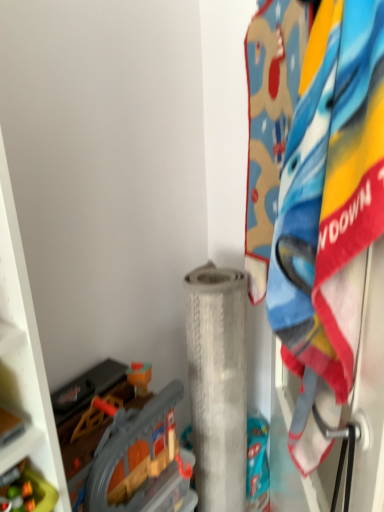
Describe the element at coordinates (328, 214) in the screenshot. I see `fluffy cotton towel at right` at that location.

Where is `white textured roll at center`? This screenshot has width=384, height=512. white textured roll at center is located at coordinates (217, 384).

Which object is thinner, fluffy cotton towel at right or white textured roll at center?

With smaller width is fluffy cotton towel at right.

Could you tell me if fluffy cotton towel at right is facing white textured roll at center?

No, fluffy cotton towel at right does not turn towards white textured roll at center.

From the image's perspective, is fluffy cotton towel at right on white textured roll at center?

Correct, fluffy cotton towel at right appears higher than white textured roll at center in the image.

Is fluffy cotton towel at right at the right side of white textured roll at center?

Correct, you'll find fluffy cotton towel at right to the right of white textured roll at center.

From a real-world perspective, is plastic gray train set at lower left, which appears as the 1th toy when viewed from the back, physically located above or below white textured roll at center?

From a real-world perspective, plastic gray train set at lower left, which appears as the 1th toy when viewed from the back, is physically above white textured roll at center.

From the image's perspective, which one is positioned higher, plastic gray train set at lower left, which appears as the second toy when viewed from the front, or white textured roll at center?

plastic gray train set at lower left, which appears as the second toy when viewed from the front.

In terms of size, does plastic gray train set at lower left, which appears as the second toy when viewed from the front, appear bigger or smaller than white textured roll at center?

plastic gray train set at lower left, which appears as the second toy when viewed from the front, is smaller than white textured roll at center.

Can you confirm if plastic gray train set at lower left, which appears as the 1th toy when viewed from the back, is taller than white textured roll at center?

Incorrect, the height of plastic gray train set at lower left, which appears as the 1th toy when viewed from the back, is not larger of that of white textured roll at center.

From the image's perspective, is fluffy cotton towel at right above or below plastic gray train set at lower left, which appears as the 1th toy when viewed from the back?

From the image's perspective, fluffy cotton towel at right appears above plastic gray train set at lower left, which appears as the 1th toy when viewed from the back.

Which is behind, fluffy cotton towel at right or plastic gray train set at lower left, which appears as the 1th toy when viewed from the back?

plastic gray train set at lower left, which appears as the 1th toy when viewed from the back, is further away from the camera.

Can you confirm if fluffy cotton towel at right is thinner than plastic gray train set at lower left, which appears as the 1th toy when viewed from the back?

Yes, fluffy cotton towel at right is thinner than plastic gray train set at lower left, which appears as the 1th toy when viewed from the back.

Would you say plastic gray train set at lower left, which appears as the 1th toy when viewed from the back, is part of fluffy cotton towel at right's contents?

Definitely not — plastic gray train set at lower left, which appears as the 1th toy when viewed from the back, is not inside fluffy cotton towel at right.

Is white textured roll at center facing away from plastic gray train set at lower left, which appears as the 1th toy when viewed from the back?

A: That's not correct — white textured roll at center is not looking away from plastic gray train set at lower left, which appears as the 1th toy when viewed from the back.

Relative to plastic gray train set at lower left, which appears as the second toy when viewed from the front, is white textured roll at center in front or behind?

Visually, white textured roll at center is located behind plastic gray train set at lower left, which appears as the second toy when viewed from the front.

Which is correct: white textured roll at center is inside plastic gray train set at lower left, which appears as the second toy when viewed from the front, or outside of it?

white textured roll at center lies outside plastic gray train set at lower left, which appears as the second toy when viewed from the front.

Is white textured roll at center at the right side of plastic gray train set at lower left, which appears as the 1th toy when viewed from the back?

Yes, white textured roll at center is to the right of plastic gray train set at lower left, which appears as the 1th toy when viewed from the back.

Find the location of `toilet paper below the translucent plastic toy at lower left, which ranks as the second toy in back-to-front order (from a real-world perspective)`. toilet paper below the translucent plastic toy at lower left, which ranks as the second toy in back-to-front order (from a real-world perspective) is located at coordinates (217, 384).

Is translucent plastic toy at lower left, positioned as the first toy in front-to-back order, at the back of white textured roll at center?

white textured roll at center does not have its back to translucent plastic toy at lower left, positioned as the first toy in front-to-back order.

Based on the photo, from the image's perspective, which object appears higher, white textured roll at center or translucent plastic toy at lower left, positioned as the first toy in front-to-back order?

translucent plastic toy at lower left, positioned as the first toy in front-to-back order, is shown above in the image.

Is translucent plastic toy at lower left, positioned as the first toy in front-to-back order, touching plastic gray train set at lower left, which appears as the second toy when viewed from the front?

No.

Is translucent plastic toy at lower left, positioned as the first toy in front-to-back order, thinner than plastic gray train set at lower left, which appears as the 1th toy when viewed from the back?

Correct, the width of translucent plastic toy at lower left, positioned as the first toy in front-to-back order, is less than that of plastic gray train set at lower left, which appears as the 1th toy when viewed from the back.

How different are the orientations of translucent plastic toy at lower left, which ranks as the second toy in back-to-front order, and plastic gray train set at lower left, which appears as the 1th toy when viewed from the back, in degrees?

They differ by 0.904 degrees in their facing directions.

Considering the relative positions of translucent plastic toy at lower left, positioned as the first toy in front-to-back order, and plastic gray train set at lower left, which appears as the second toy when viewed from the front, in the image provided, is translucent plastic toy at lower left, positioned as the first toy in front-to-back order, behind plastic gray train set at lower left, which appears as the second toy when viewed from the front,?

That is False.

From the image's perspective, is plastic gray train set at lower left, which appears as the second toy when viewed from the front, under translucent plastic toy at lower left, which ranks as the second toy in back-to-front order?

Indeed, from the image's perspective, plastic gray train set at lower left, which appears as the second toy when viewed from the front, is shown beneath translucent plastic toy at lower left, which ranks as the second toy in back-to-front order.

Consider the image. In terms of size, does plastic gray train set at lower left, which appears as the second toy when viewed from the front, appear bigger or smaller than translucent plastic toy at lower left, positioned as the first toy in front-to-back order?

In the image, plastic gray train set at lower left, which appears as the second toy when viewed from the front, appears to be larger than translucent plastic toy at lower left, positioned as the first toy in front-to-back order.

Considering the sizes of objects plastic gray train set at lower left, which appears as the 1th toy when viewed from the back, and translucent plastic toy at lower left, which ranks as the second toy in back-to-front order, in the image provided, who is taller, plastic gray train set at lower left, which appears as the 1th toy when viewed from the back, or translucent plastic toy at lower left, which ranks as the second toy in back-to-front order,?

With more height is plastic gray train set at lower left, which appears as the 1th toy when viewed from the back.

From the picture: Which is nearer, (119, 497) or (32, 477)?

Clearly, point (119, 497) is more distant from the camera than point (32, 477).

Image resolution: width=384 pixels, height=512 pixels. In order to click on laundry that appears above the white textured roll at center (from a real-world perspective) in this screenshot , I will do `click(328, 214)`.

Identify the location of toilet paper behind the plastic gray train set at lower left, which appears as the 1th toy when viewed from the back. (217, 384).

From the image, which object appears to be nearer to white textured roll at center, plastic gray train set at lower left, which appears as the second toy when viewed from the front, or fluffy cotton towel at right?

plastic gray train set at lower left, which appears as the second toy when viewed from the front, is closer to white textured roll at center.

Which object lies further to the anchor point white textured roll at center, fluffy cotton towel at right or plastic gray train set at lower left, which appears as the second toy when viewed from the front?

fluffy cotton towel at right is positioned further to the anchor white textured roll at center.

From the image, which object appears to be nearer to translucent plastic toy at lower left, positioned as the first toy in front-to-back order, plastic gray train set at lower left, which appears as the 1th toy when viewed from the back, or white textured roll at center?

plastic gray train set at lower left, which appears as the 1th toy when viewed from the back, is positioned closer to the anchor translucent plastic toy at lower left, positioned as the first toy in front-to-back order.

From the image, which object appears to be nearer to fluffy cotton towel at right, plastic gray train set at lower left, which appears as the second toy when viewed from the front, or translucent plastic toy at lower left, which ranks as the second toy in back-to-front order?

plastic gray train set at lower left, which appears as the second toy when viewed from the front.

Looking at the image, which one is located further to fluffy cotton towel at right, white textured roll at center or plastic gray train set at lower left, which appears as the 1th toy when viewed from the back?

white textured roll at center.

Based on their spatial positions, is white textured roll at center or plastic gray train set at lower left, which appears as the 1th toy when viewed from the back, closer to translucent plastic toy at lower left, which ranks as the second toy in back-to-front order?

plastic gray train set at lower left, which appears as the 1th toy when viewed from the back, is positioned closer to the anchor translucent plastic toy at lower left, which ranks as the second toy in back-to-front order.

From the image, which object appears to be nearer to translucent plastic toy at lower left, which ranks as the second toy in back-to-front order, plastic gray train set at lower left, which appears as the second toy when viewed from the front, or fluffy cotton towel at right?

Among the two, plastic gray train set at lower left, which appears as the second toy when viewed from the front, is located nearer to translucent plastic toy at lower left, which ranks as the second toy in back-to-front order.

When comparing their distances from plastic gray train set at lower left, which appears as the 1th toy when viewed from the back, does white textured roll at center or translucent plastic toy at lower left, which ranks as the second toy in back-to-front order, seem closer?

white textured roll at center is positioned closer to the anchor plastic gray train set at lower left, which appears as the 1th toy when viewed from the back.

The height and width of the screenshot is (512, 384). Identify the location of toy between translucent plastic toy at lower left, which ranks as the second toy in back-to-front order, and fluffy cotton towel at right. (128, 450).

The height and width of the screenshot is (512, 384). Find the location of `toy between translucent plastic toy at lower left, positioned as the first toy in front-to-back order, and white textured roll at center in the front-back direction`. toy between translucent plastic toy at lower left, positioned as the first toy in front-to-back order, and white textured roll at center in the front-back direction is located at coordinates [x=128, y=450].